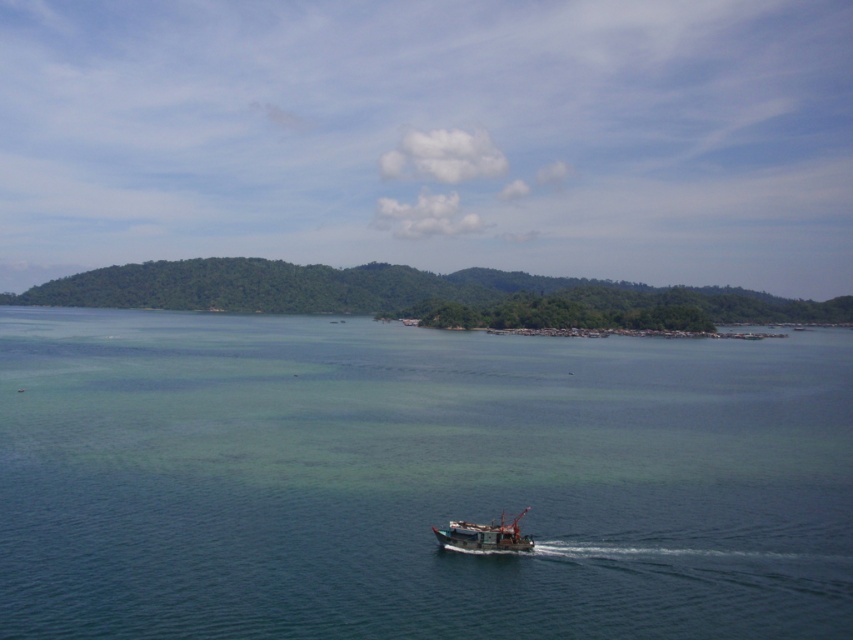
Is clear blue water at center shorter than wooden fishing boat at center?

No.

Which is above, clear blue water at center or wooden fishing boat at center?

clear blue water at center

Describe the element at coordinates (416, 480) in the screenshot. I see `clear blue water at center` at that location.

Where is `clear blue water at center`? The width and height of the screenshot is (853, 640). clear blue water at center is located at coordinates (416, 480).